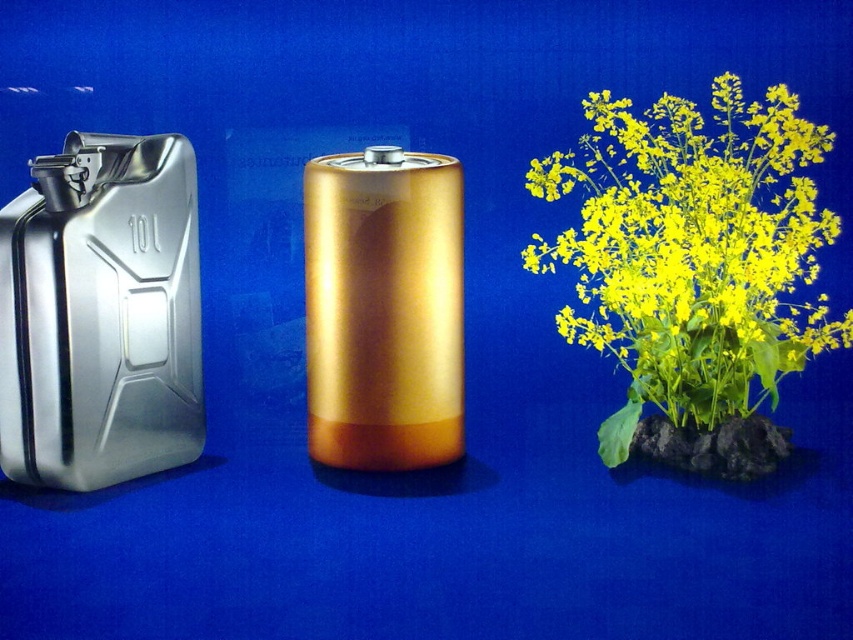
Question: Among these objects, which one is farthest from the camera?

Choices:
 (A) yellow matte plant at center
 (B) brushed metal canister at left

Answer: (A)

Question: Can you confirm if yellow matte plant at center is positioned below brushed metal canister at left?

Choices:
 (A) no
 (B) yes

Answer: (A)

Question: Which point is closer to the camera taking this photo?

Choices:
 (A) (624, 170)
 (B) (45, 204)

Answer: (B)

Question: Can you confirm if yellow matte plant at center is smaller than brushed metal canister at left?

Choices:
 (A) yes
 (B) no

Answer: (B)

Question: Is yellow matte plant at center below brushed metal canister at left?

Choices:
 (A) no
 (B) yes

Answer: (A)

Question: Which of the following is the closest to the observer?

Choices:
 (A) (610, 108)
 (B) (86, 342)

Answer: (B)